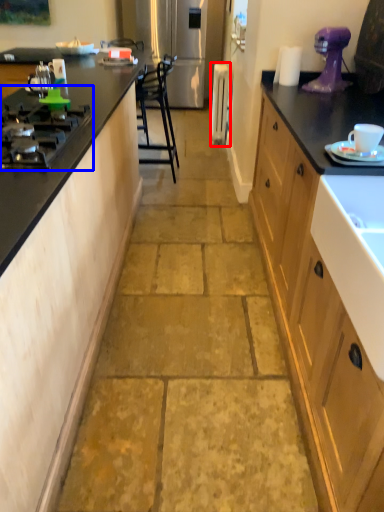
Question: Which of the following is the farthest to the observer, appliance (highlighted by a red box) or gas stove (highlighted by a blue box)?

Choices:
 (A) appliance
 (B) gas stove

Answer: (A)